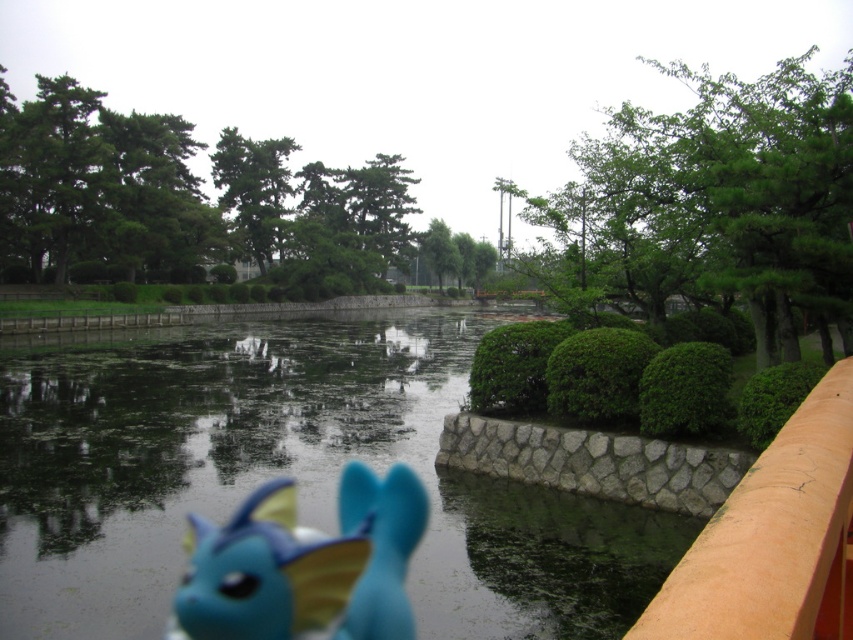
Does blue matte plush toy at lower center appear under green matte tree at upper center?

Correct, blue matte plush toy at lower center is located below green matte tree at upper center.

Does blue matte plush toy at lower center appear on the left side of green matte tree at upper center?

No, blue matte plush toy at lower center is not to the left of green matte tree at upper center.

Where is `blue matte plush toy at lower center`? blue matte plush toy at lower center is located at coordinates (305, 564).

Does point (648, 230) come behind point (451, 252)?

No, it is in front of (451, 252).

Does point (689, 182) lie in front of point (422, 236)?

Yes, point (689, 182) is in front of point (422, 236).

Is point (782, 195) behind point (419, 236)?

That is False.

This screenshot has height=640, width=853. Identify the location of green leafy tree at upper right. (717, 202).

Can you confirm if blue plush toy at center is thinner than green matte tree at upper center?

Correct, blue plush toy at center's width is less than green matte tree at upper center's.

Can you confirm if blue plush toy at center is positioned above green matte tree at upper center?

No.

Identify the location of blue plush toy at center. Image resolution: width=853 pixels, height=640 pixels. 381,547.